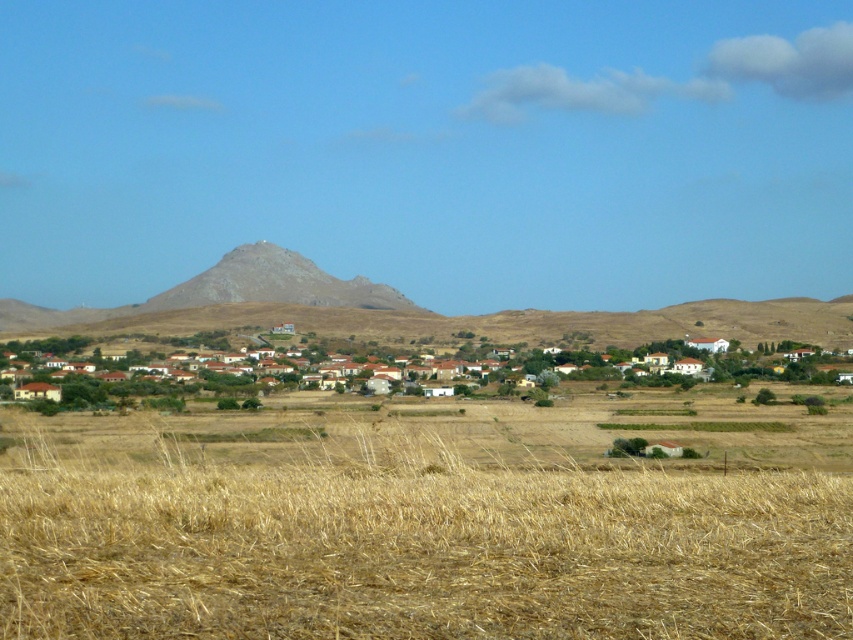
Question: Can you confirm if dry straw field at lower center is positioned below brown clay houses at center?

Choices:
 (A) no
 (B) yes

Answer: (B)

Question: Which of the following is the closest to the observer?

Choices:
 (A) dry straw field at lower center
 (B) brown clay houses at center

Answer: (A)

Question: Which of the following is the farthest from the observer?

Choices:
 (A) (148, 339)
 (B) (723, 604)

Answer: (A)

Question: Can you confirm if dry straw field at lower center is positioned to the left of brown clay houses at center?

Choices:
 (A) no
 (B) yes

Answer: (A)

Question: Can you confirm if dry straw field at lower center is positioned to the left of brown clay houses at center?

Choices:
 (A) no
 (B) yes

Answer: (A)